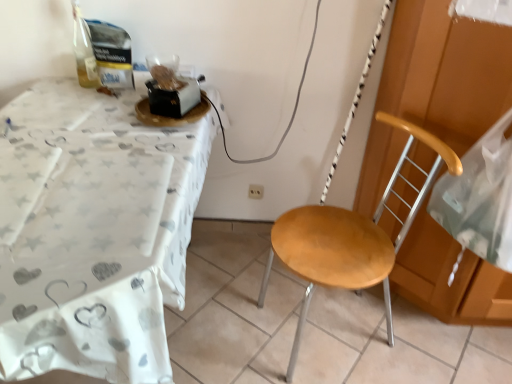
Question: Is white plastic power outlet at center outside white fabric table at left?

Choices:
 (A) no
 (B) yes

Answer: (B)

Question: Considering the relative sizes of white plastic power outlet at center and white fabric table at left in the image provided, is white plastic power outlet at center smaller than white fabric table at left?

Choices:
 (A) no
 (B) yes

Answer: (B)

Question: Would you say white plastic power outlet at center is a long distance from white fabric table at left?

Choices:
 (A) no
 (B) yes

Answer: (A)

Question: Is white plastic power outlet at center taller than white fabric table at left?

Choices:
 (A) no
 (B) yes

Answer: (A)

Question: Is white plastic power outlet at center next to white fabric table at left and touching it?

Choices:
 (A) no
 (B) yes

Answer: (A)

Question: Considering the relative sizes of white plastic power outlet at center and white fabric table at left in the image provided, is white plastic power outlet at center bigger than white fabric table at left?

Choices:
 (A) yes
 (B) no

Answer: (B)

Question: Can you confirm if white plastic power outlet at center is taller than wooden seat at center?

Choices:
 (A) yes
 (B) no

Answer: (B)

Question: From a real-world perspective, does white plastic power outlet at center stand above wooden seat at center?

Choices:
 (A) yes
 (B) no

Answer: (B)

Question: Considering the relative sizes of white plastic power outlet at center and wooden seat at center in the image provided, is white plastic power outlet at center smaller than wooden seat at center?

Choices:
 (A) no
 (B) yes

Answer: (B)

Question: Can we say white plastic power outlet at center lies outside wooden seat at center?

Choices:
 (A) no
 (B) yes

Answer: (B)

Question: Is the position of white plastic power outlet at center less distant than that of wooden seat at center?

Choices:
 (A) yes
 (B) no

Answer: (B)

Question: From the image's perspective, is white plastic power outlet at center under wooden seat at center?

Choices:
 (A) yes
 (B) no

Answer: (B)

Question: Is transparent plastic bag at right taller than white plastic power outlet at center?

Choices:
 (A) no
 (B) yes

Answer: (B)